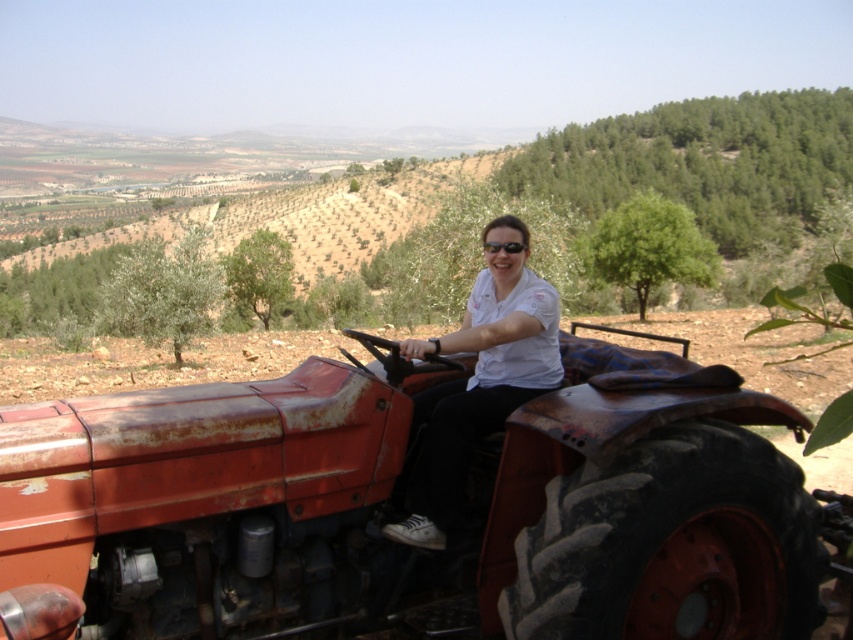
You are standing at the starting point and see two points in the scene. The first point is at coordinate point (187, 596) and the second point is at coordinate point (503, 244). Which point is closer to you?

Point (187, 596) is in front of point (503, 244), so it is closer to you.

Looking at this image, you are standing at the origin point in the image. Which object is located at the coordinate point (399, 508)?

The rusty metal tractor at center is located at the coordinate point (399, 508).